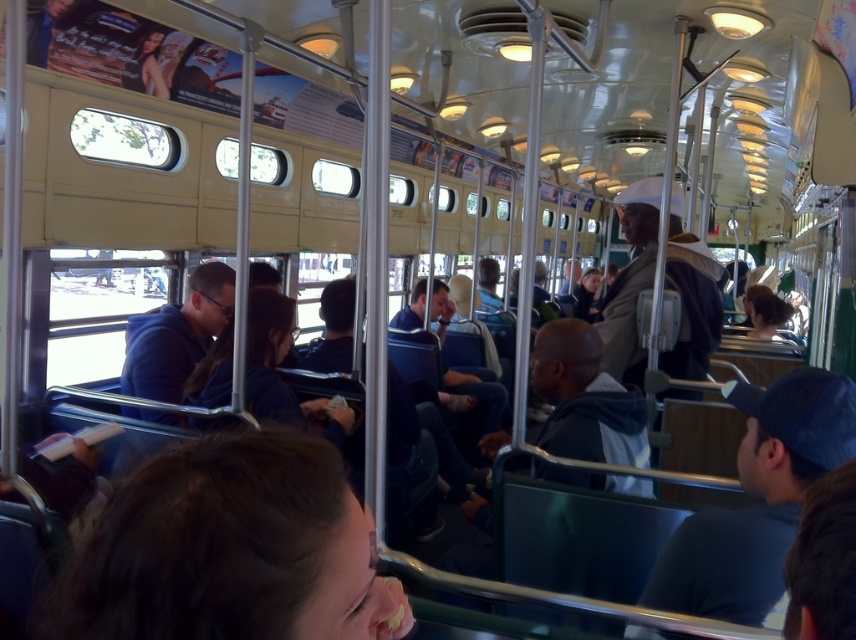
Question: Which of the following is the farthest from the observer?

Choices:
 (A) (177, 556)
 (B) (797, 508)

Answer: (B)

Question: Does blue fabric cap at right appear over brown matte hard hat at center?

Choices:
 (A) no
 (B) yes

Answer: (A)

Question: Which point is closer to the camera taking this photo?

Choices:
 (A) (663, 364)
 (B) (767, 582)
 (C) (260, 612)

Answer: (C)

Question: Considering the real-world distances, which object is closest to the brown matte hard hat at center?

Choices:
 (A) dark brown hair at lower center
 (B) blue fabric cap at right

Answer: (B)

Question: Does blue fabric cap at right have a greater width compared to brown matte hard hat at center?

Choices:
 (A) no
 (B) yes

Answer: (A)

Question: Does dark brown hair at lower center appear on the right side of brown matte hard hat at center?

Choices:
 (A) yes
 (B) no

Answer: (B)